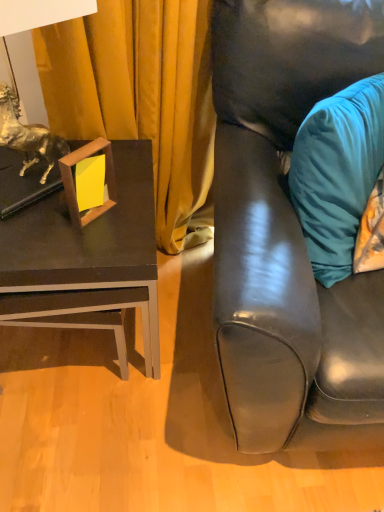
Locate an element on the screen. The height and width of the screenshot is (512, 384). vacant area that is in front of matte black table at left is located at coordinates (101, 442).